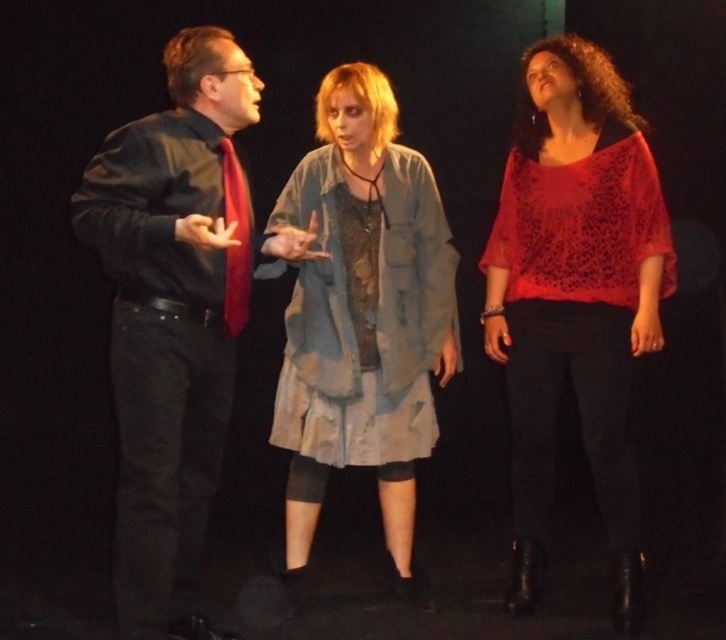
How far apart are knitted red blouse at right and matte red tie at left?

They are 3.30 feet apart.

Between knitted red blouse at right and matte red tie at left, which one is positioned lower?

knitted red blouse at right

This screenshot has width=726, height=640. I want to click on knitted red blouse at right, so click(575, 294).

This screenshot has height=640, width=726. Identify the location of matte black shirt at left. (168, 321).

Which is in front, point (648, 332) or point (285, 198)?

Point (648, 332) is more forward.

Does point (643, 141) lie behind point (420, 403)?

No, it is not.

Is point (505, 170) farther from camera compared to point (391, 211)?

Yes, it is behind point (391, 211).

This screenshot has width=726, height=640. Identify the location of knitted red blouse at right. (575, 294).